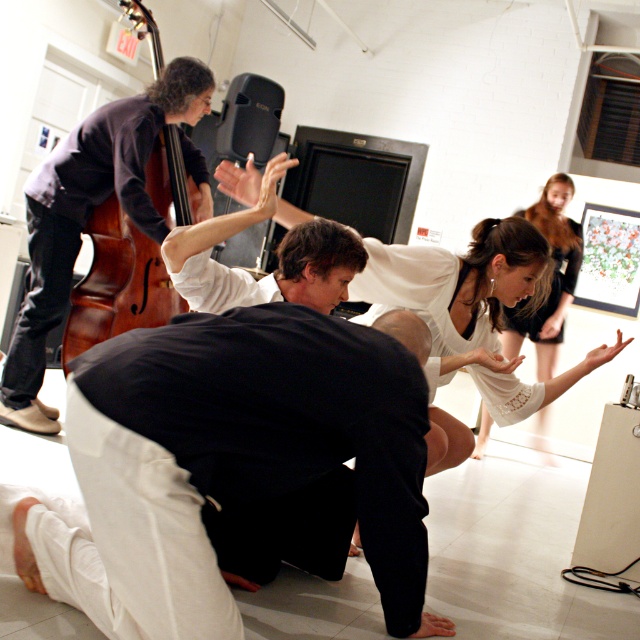
Is black matte pants at lower center wider than white lace dress at upper right?

Correct, the width of black matte pants at lower center exceeds that of white lace dress at upper right.

The image size is (640, 640). Describe the element at coordinates (276, 422) in the screenshot. I see `black matte pants at lower center` at that location.

Which is behind, point (381, 378) or point (557, 232)?

The point (557, 232) is more distant.

Identify the location of black matte pants at lower center. The image size is (640, 640). (276, 422).

Between black matte pants at lower center and brown wooden cello at left, which one is positioned higher?

brown wooden cello at left

Who is shorter, black matte pants at lower center or brown wooden cello at left?

Standing shorter between the two is black matte pants at lower center.

Which is behind, point (253, 387) or point (106, 246)?

The point (106, 246) is more distant.

This screenshot has width=640, height=640. What are the coordinates of `black matte pants at lower center` in the screenshot? It's located at (276, 422).

Is white lace dress at center to the right of brown wooden cello at left from the viewer's perspective?

Correct, you'll find white lace dress at center to the right of brown wooden cello at left.

Is point (513, 385) farther from camera compared to point (120, 298)?

No, it is not.

This screenshot has width=640, height=640. What are the coordinates of `white lace dress at center` in the screenshot? It's located at (472, 316).